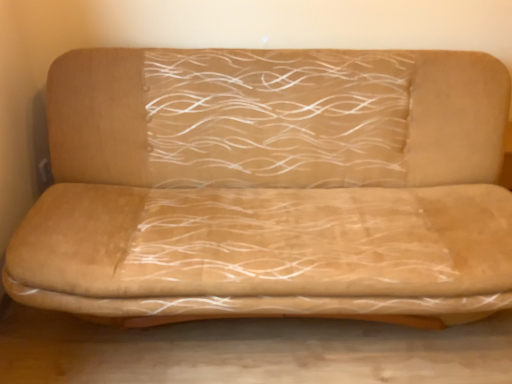
What do you see at coordinates (270, 187) in the screenshot? Image resolution: width=512 pixels, height=384 pixels. I see `beige suede couch at center` at bounding box center [270, 187].

Where is `beige suede couch at center`? Image resolution: width=512 pixels, height=384 pixels. beige suede couch at center is located at coordinates click(270, 187).

I want to click on beige suede couch at center, so click(270, 187).